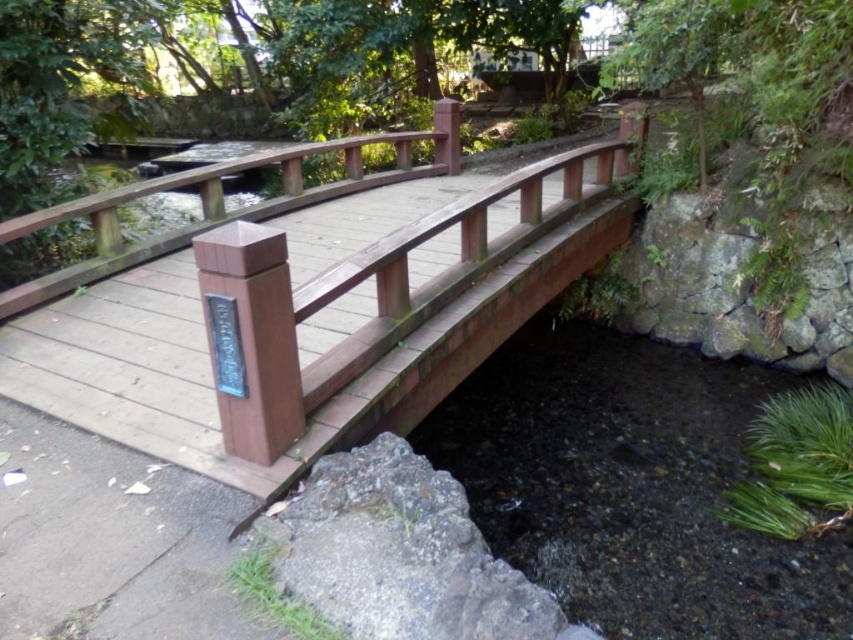
Who is more distant from viewer, (257, 472) or (361, 518)?

Positioned behind is point (257, 472).

Is wooden bridge at center to the left of gray rough stone at lower left from the viewer's perspective?

In fact, wooden bridge at center is to the right of gray rough stone at lower left.

Find the location of a particular element. The height and width of the screenshot is (640, 853). wooden bridge at center is located at coordinates (329, 328).